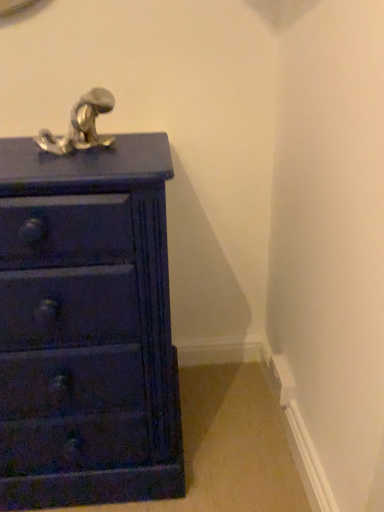
Locate an element on the screen. matte dark blue chest of drawers at left is located at coordinates (86, 327).

The width and height of the screenshot is (384, 512). Describe the element at coordinates (86, 327) in the screenshot. I see `matte dark blue chest of drawers at left` at that location.

What do you see at coordinates (81, 126) in the screenshot?
I see `satin nickel faucet at upper left` at bounding box center [81, 126].

Where is `satin nickel faucet at upper left`? This screenshot has width=384, height=512. satin nickel faucet at upper left is located at coordinates (81, 126).

Locate an element on the screen. The height and width of the screenshot is (512, 384). matte dark blue chest of drawers at left is located at coordinates (86, 327).

Considering the relative positions of satin nickel faucet at upper left and matte dark blue chest of drawers at left in the image provided, is satin nickel faucet at upper left to the left of matte dark blue chest of drawers at left from the viewer's perspective?

No.

Is satin nickel faucet at upper left closer to camera compared to matte dark blue chest of drawers at left?

No, it is behind matte dark blue chest of drawers at left.

Which is nearer, [99,105] or [27,465]?

Point [99,105] is positioned closer to the camera compared to point [27,465].

From the image's perspective, between satin nickel faucet at upper left and matte dark blue chest of drawers at left, which one is located above?

From the image's view, satin nickel faucet at upper left is above.

From a real-world perspective, which is physically above, satin nickel faucet at upper left or matte dark blue chest of drawers at left?

In real-world perspective, satin nickel faucet at upper left is above.

Is satin nickel faucet at upper left wider or thinner than matte dark blue chest of drawers at left?

satin nickel faucet at upper left is thinner than matte dark blue chest of drawers at left.

Does satin nickel faucet at upper left have a lesser height compared to matte dark blue chest of drawers at left?

Yes, satin nickel faucet at upper left is shorter than matte dark blue chest of drawers at left.

Considering the relative sizes of satin nickel faucet at upper left and matte dark blue chest of drawers at left in the image provided, is satin nickel faucet at upper left smaller than matte dark blue chest of drawers at left?

Correct, satin nickel faucet at upper left occupies less space than matte dark blue chest of drawers at left.

Is satin nickel faucet at upper left situated inside matte dark blue chest of drawers at left or outside?

satin nickel faucet at upper left is not enclosed by matte dark blue chest of drawers at left.

Would you say satin nickel faucet at upper left is a long distance from matte dark blue chest of drawers at left?

Actually, satin nickel faucet at upper left and matte dark blue chest of drawers at left are a little close together.

Could you tell me if satin nickel faucet at upper left is turned towards matte dark blue chest of drawers at left?

No.

How many degrees apart are the facing directions of satin nickel faucet at upper left and matte dark blue chest of drawers at left?

The angle between the facing direction of satin nickel faucet at upper left and the facing direction of matte dark blue chest of drawers at left is 1.26 degrees.

Find the location of a particular element. The height and width of the screenshot is (512, 384). chest of drawers in front of the satin nickel faucet at upper left is located at coordinates (86, 327).

Looking at this image, is matte dark blue chest of drawers at left at the right side of satin nickel faucet at upper left?

In fact, matte dark blue chest of drawers at left is to the left of satin nickel faucet at upper left.

Which object is further away from the camera taking this photo, matte dark blue chest of drawers at left or satin nickel faucet at upper left?

satin nickel faucet at upper left is further from the camera.

Does point (17, 234) lie in front of point (76, 144)?

Yes, it is.

From the image's perspective, which is below, matte dark blue chest of drawers at left or satin nickel faucet at upper left?

matte dark blue chest of drawers at left.

Consider the image. From a real-world perspective, which is physically below, matte dark blue chest of drawers at left or satin nickel faucet at upper left?

matte dark blue chest of drawers at left, from a real-world perspective.

Between matte dark blue chest of drawers at left and satin nickel faucet at upper left, which one has larger width?

matte dark blue chest of drawers at left is wider.

In the scene shown: Is matte dark blue chest of drawers at left taller or shorter than satin nickel faucet at upper left?

Considering their sizes, matte dark blue chest of drawers at left has more height than satin nickel faucet at upper left.

Which of these two, matte dark blue chest of drawers at left or satin nickel faucet at upper left, is smaller?

satin nickel faucet at upper left is smaller.

Can satin nickel faucet at upper left be found inside matte dark blue chest of drawers at left?

Actually, satin nickel faucet at upper left is outside matte dark blue chest of drawers at left.

Is matte dark blue chest of drawers at left not near satin nickel faucet at upper left?

No, matte dark blue chest of drawers at left is not far from satin nickel faucet at upper left.

Is matte dark blue chest of drawers at left aimed at satin nickel faucet at upper left?

No, matte dark blue chest of drawers at left is not facing towards satin nickel faucet at upper left.

How different are the orientations of matte dark blue chest of drawers at left and satin nickel faucet at upper left in degrees?

The angular difference between matte dark blue chest of drawers at left and satin nickel faucet at upper left is 1.26 degrees.

The width and height of the screenshot is (384, 512). What are the coordinates of `the chest of drawers that appears below the satin nickel faucet at upper left (from the image's perspective)` in the screenshot? It's located at (86, 327).

The width and height of the screenshot is (384, 512). Find the location of `tap behind the matte dark blue chest of drawers at left`. tap behind the matte dark blue chest of drawers at left is located at coordinates pyautogui.click(x=81, y=126).

This screenshot has width=384, height=512. In order to click on the chest of drawers beneath the satin nickel faucet at upper left (from a real-world perspective) in this screenshot , I will do `click(86, 327)`.